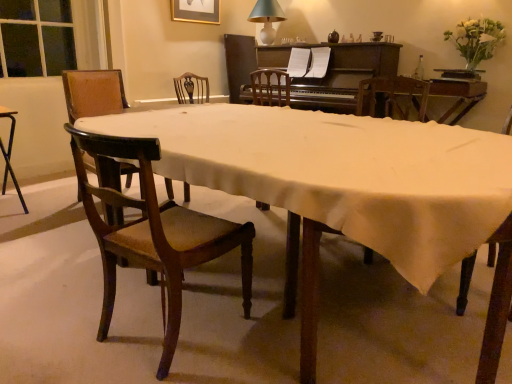
Question: Is wooden table at center touching black metal desk at left?

Choices:
 (A) no
 (B) yes

Answer: (A)

Question: Is wooden table at center positioned beyond the bounds of black metal desk at left?

Choices:
 (A) yes
 (B) no

Answer: (A)

Question: Would you say wooden table at center is a long distance from black metal desk at left?

Choices:
 (A) no
 (B) yes

Answer: (B)

Question: Does wooden table at center have a smaller size compared to black metal desk at left?

Choices:
 (A) no
 (B) yes

Answer: (A)

Question: Can you confirm if wooden table at center is positioned to the right of black metal desk at left?

Choices:
 (A) no
 (B) yes

Answer: (B)

Question: Could black metal desk at left be considered to be inside wooden table at center?

Choices:
 (A) yes
 (B) no

Answer: (B)

Question: Is white ceramic lamp at upper center far from dark brown polished wood piano at upper center?

Choices:
 (A) yes
 (B) no

Answer: (A)

Question: Is white ceramic lamp at upper center aimed at dark brown polished wood piano at upper center?

Choices:
 (A) yes
 (B) no

Answer: (B)

Question: Is white ceramic lamp at upper center shorter than dark brown polished wood piano at upper center?

Choices:
 (A) no
 (B) yes

Answer: (B)

Question: Is white ceramic lamp at upper center turned away from dark brown polished wood piano at upper center?

Choices:
 (A) yes
 (B) no

Answer: (B)

Question: Is white ceramic lamp at upper center placed right next to dark brown polished wood piano at upper center?

Choices:
 (A) yes
 (B) no

Answer: (B)

Question: Considering the relative positions of white ceramic lamp at upper center and dark brown polished wood piano at upper center in the image provided, is white ceramic lamp at upper center in front of dark brown polished wood piano at upper center?

Choices:
 (A) yes
 (B) no

Answer: (B)

Question: Is black metal desk at left at the left side of mahogany wood chair at lower left, the second chair from the left?

Choices:
 (A) yes
 (B) no

Answer: (A)